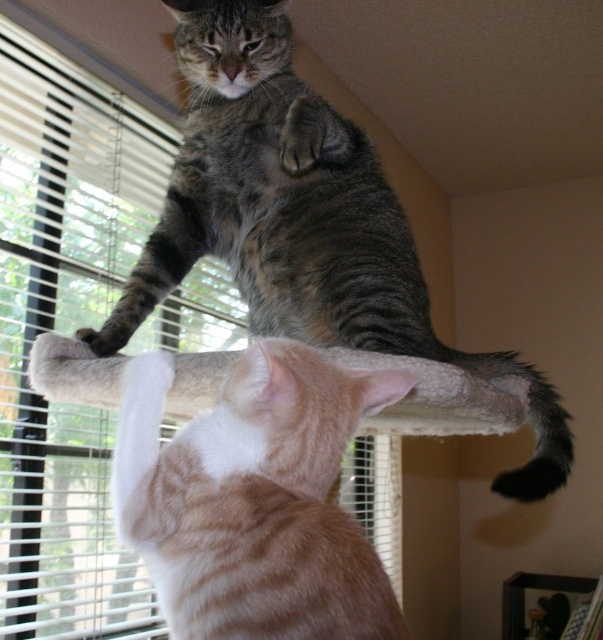
Question: Is the position of gray tabby cat at upper center less distant than that of orange tabby cat at upper center?

Choices:
 (A) no
 (B) yes

Answer: (A)

Question: Is gray tabby cat at upper center below orange tabby cat at upper center?

Choices:
 (A) yes
 (B) no

Answer: (B)

Question: Is gray tabby cat at upper center to the left of orange tabby cat at upper center from the viewer's perspective?

Choices:
 (A) no
 (B) yes

Answer: (A)